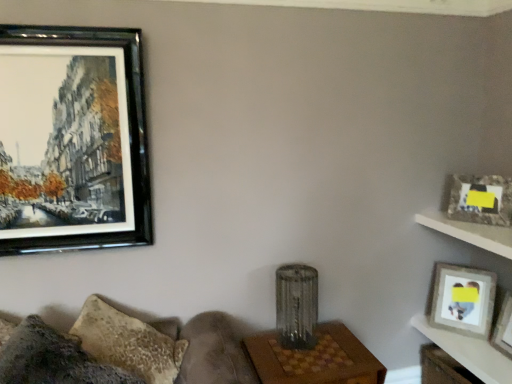
Identify the location of unoccupied region to the right of metallic textured lamp at center. The image size is (512, 384). (345, 354).